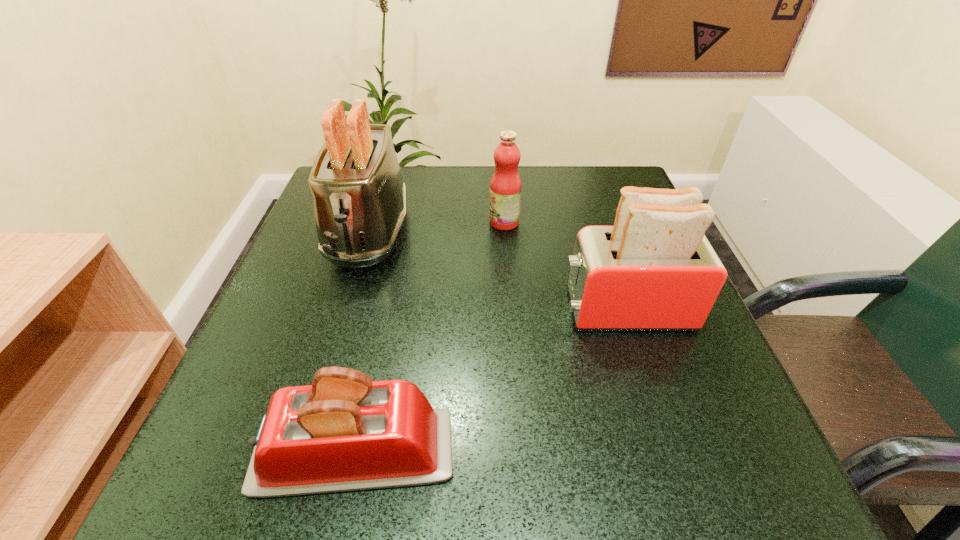
Find the location of a particular element. This screenshot has height=540, width=960. free location located on the front label of the second object from right to left is located at coordinates (396, 222).

The height and width of the screenshot is (540, 960). I want to click on free space located on the front label of the second object from right to left, so click(449, 222).

At what (x,y) coordinates should I click in order to perform the action: click on vacant space located on the front label of the second object from right to left. Please return your answer as a coordinate pair (x, y). The width and height of the screenshot is (960, 540). Looking at the image, I should click on (396, 222).

The width and height of the screenshot is (960, 540). I want to click on free region located on the back of the shortest toaster, so click(x=395, y=264).

Image resolution: width=960 pixels, height=540 pixels. In order to click on toaster present at the far edge in this screenshot , I will do `click(359, 198)`.

The image size is (960, 540). I want to click on fruit juice at the far edge, so click(505, 187).

Locate an element on the screen. This screenshot has height=540, width=960. object positioned at the near edge is located at coordinates (345, 432).

Locate an element on the screen. This screenshot has height=540, width=960. object located in the right edge section of the desktop is located at coordinates (654, 270).

Find the location of a particular element. This screenshot has height=540, width=960. object that is at the far left corner is located at coordinates (359, 198).

Image resolution: width=960 pixels, height=540 pixels. In order to click on object positioned at the near left corner in this screenshot , I will do `click(345, 432)`.